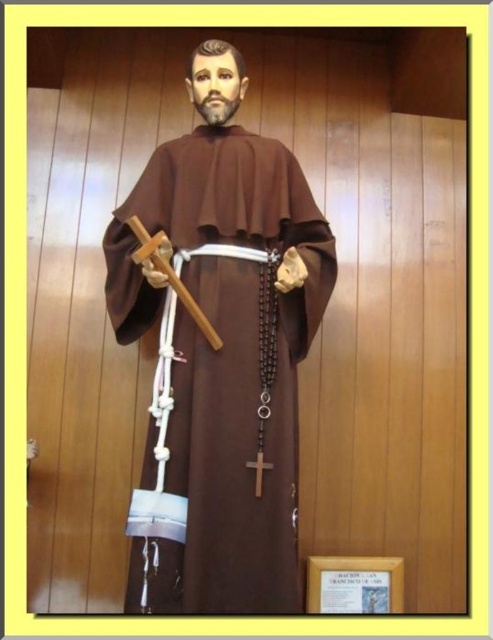
You are standing in front of the statue and want to touch both points on it. Which point should you reach for first, point (220, 285) or point (263, 458)?

You should reach for point (220, 285) first because it is closer to you than point (263, 458).

You are an art student analyzing the statue. You notice the brown matte robe at center and the wooden cross at center. Which object occupies more horizontal space in the image?

The brown matte robe at center might be wider than wooden cross at center, so it likely occupies more horizontal space in the image.